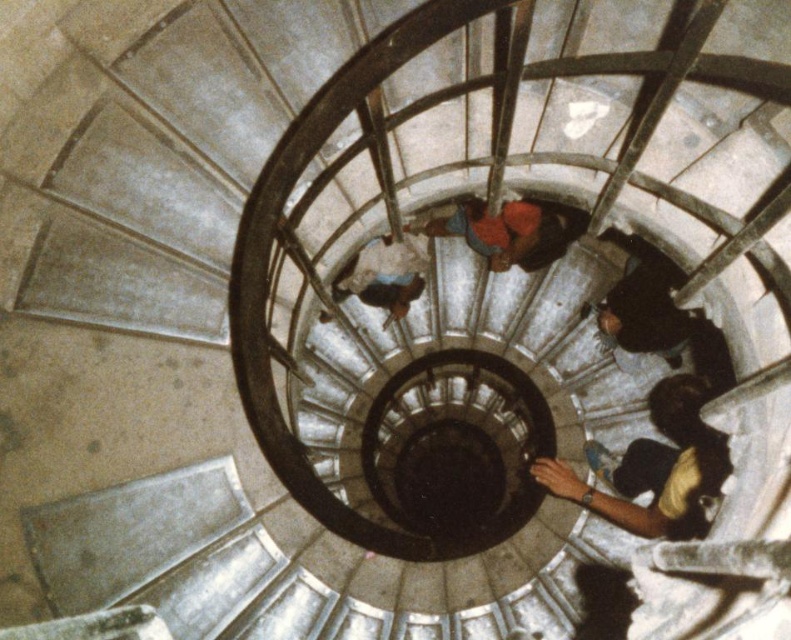
You are standing at the viewpoint of the image and see two points labeled as point (530, 259) and point (407, 234) on the spiral staircase. If you were to walk towards the center of the spiral, which point would you encounter first?

Point (407, 234) would be encountered first because it is in front of point (530, 259) when approaching the center of the spiral staircase.

You are standing at the top of the spiral staircase and want to place a small decorative item on the step closest to you. Which object, the dark blue jeans at bottom right or the blue fabric at center, would you choose to place it near to ensure it stays visible?

You should place the small decorative item near the blue fabric at center because it is smaller and less likely to obstruct the view, ensuring the item remains visible.